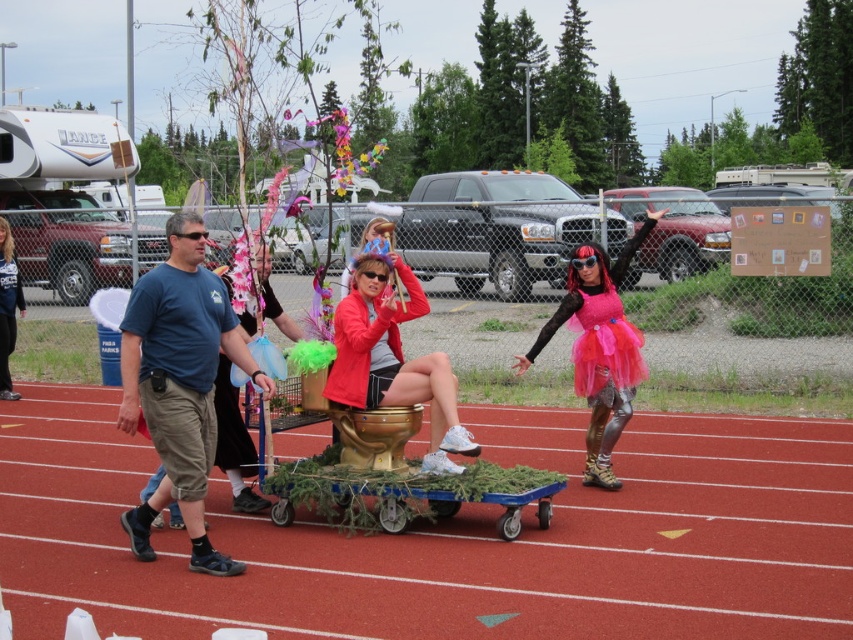
Consider the image. You are standing at the starting line of the running track and see two points marked in the image. Which point is closer to you, point (x=438, y=417) or point (x=13, y=308)?

Point (x=438, y=417) is in front of point (x=13, y=308), so it is closer to you.

Based on the photo, you are a runner preparing to sprint on the red rubber track at center. You notice a brushed metal jacket at center nearby. Which object is narrower in width?

The red rubber track at center is narrower in width compared to the brushed metal jacket at center.

You are a photographer at the community event. You want to take a photo of the gold metallic toilet at center and the brushed metal jacket at center. Which object should you focus on first if you want to capture both in the frame without moving the camera?

You should focus on the gold metallic toilet at center first because it is larger in size compared to the brushed metal jacket at center, ensuring it is properly framed before adjusting for the smaller object.